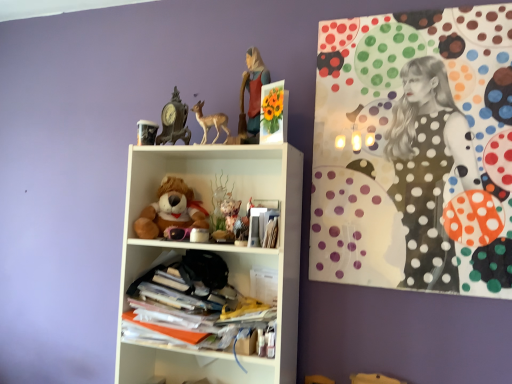
Question: Is matte brown deer at upper center directly adjacent to stacked papers at center, which is the second shelf in top-to-bottom order?

Choices:
 (A) yes
 (B) no

Answer: (B)

Question: Is matte brown deer at upper center turned away from stacked papers at center, which is the 1th shelf in bottom-to-top order?

Choices:
 (A) no
 (B) yes

Answer: (A)

Question: From a real-world perspective, is matte brown deer at upper center positioned under stacked papers at center, which is the 1th shelf in bottom-to-top order, based on gravity?

Choices:
 (A) no
 (B) yes

Answer: (A)

Question: Considering the relative sizes of matte brown deer at upper center and stacked papers at center, which is the second shelf in top-to-bottom order, in the image provided, is matte brown deer at upper center bigger than stacked papers at center, which is the second shelf in top-to-bottom order,?

Choices:
 (A) no
 (B) yes

Answer: (A)

Question: Is matte brown deer at upper center to the left of stacked papers at center, which is the 1th shelf in bottom-to-top order, from the viewer's perspective?

Choices:
 (A) yes
 (B) no

Answer: (B)

Question: Choose the correct answer: Is soft plush teddy bear at center inside matte paper magazine at center or outside it?

Choices:
 (A) inside
 (B) outside

Answer: (B)

Question: From a real-world perspective, is soft plush teddy bear at center above or below matte paper magazine at center?

Choices:
 (A) below
 (B) above

Answer: (B)

Question: Would you say soft plush teddy bear at center is to the left or to the right of matte paper magazine at center in the picture?

Choices:
 (A) left
 (B) right

Answer: (A)

Question: In terms of size, does soft plush teddy bear at center appear bigger or smaller than matte paper magazine at center?

Choices:
 (A) small
 (B) big

Answer: (B)

Question: From the image's perspective, relative to polka dot canvas at upper right, is matte brown deer at upper center above or below?

Choices:
 (A) above
 (B) below

Answer: (A)

Question: Considering their positions, is matte brown deer at upper center located in front of or behind polka dot canvas at upper right?

Choices:
 (A) front
 (B) behind

Answer: (B)

Question: Is point (218, 135) closer or farther from the camera than point (478, 79)?

Choices:
 (A) closer
 (B) farther

Answer: (B)

Question: In terms of width, does matte brown deer at upper center look wider or thinner when compared to polka dot canvas at upper right?

Choices:
 (A) thin
 (B) wide

Answer: (B)

Question: Based on their sizes in the image, would you say white matte shelf at center, placed as the 2th shelf when sorted from bottom to top, is bigger or smaller than antique bronze clock at upper center?

Choices:
 (A) small
 (B) big

Answer: (B)

Question: Is white matte shelf at center, placed as the 2th shelf when sorted from bottom to top, spatially inside antique bronze clock at upper center, or outside of it?

Choices:
 (A) outside
 (B) inside

Answer: (A)